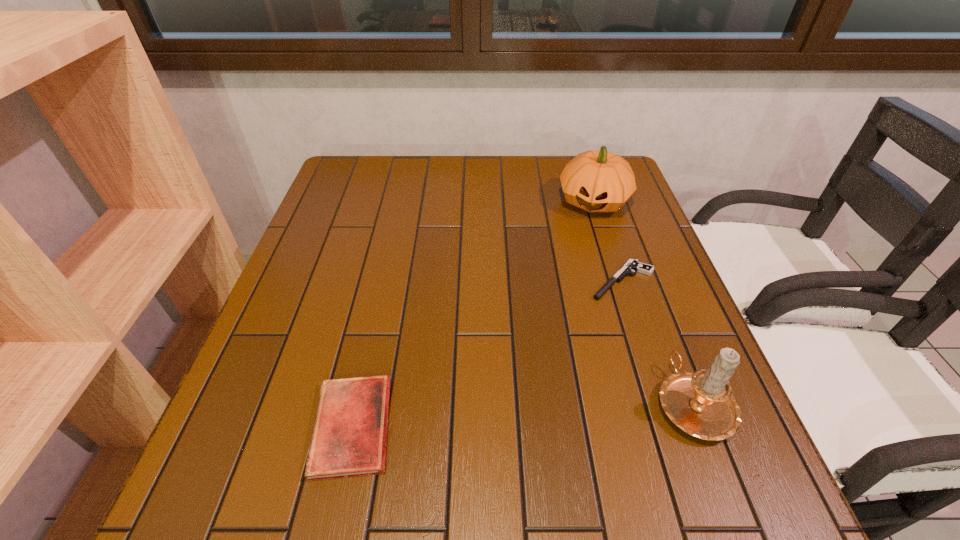
At what (x,y) coordinates should I click in order to perform the action: click on vacant space located on the front-facing side of the shortest object. Please return your answer as a coordinate pair (x, y). Looking at the image, I should click on [557, 347].

You are a GUI agent. You are given a task and a screenshot of the screen. Output one action in this format:
    pyautogui.click(x=<x>, y=<y>)
    Task: Click on the free space located on the side of the gourd with the carved face
    This screenshot has width=960, height=540.
    Given the screenshot: What is the action you would take?
    pyautogui.click(x=563, y=310)

In order to click on vacant space located 0.150m on the side of the gourd with the carved face in this screenshot , I will do coord(578,256).

Find the location of a particular element. The image size is (960, 540). vacant space located on the side of the gourd with the carved face is located at coordinates (559, 324).

Where is `object at the far edge`? The width and height of the screenshot is (960, 540). object at the far edge is located at coordinates (595, 181).

The height and width of the screenshot is (540, 960). What are the coordinates of `diary that is positioned at the near edge` in the screenshot? It's located at (349, 438).

You are a GUI agent. You are given a task and a screenshot of the screen. Output one action in this format:
    pyautogui.click(x=<x>, y=<y>)
    Task: Click on the candle located in the near edge section of the desktop
    The width and height of the screenshot is (960, 540).
    Given the screenshot: What is the action you would take?
    pyautogui.click(x=701, y=403)

Find the location of a particular element. Image resolution: width=960 pixels, height=540 pixels. object present at the left edge is located at coordinates (349, 438).

Where is `candle located at the right edge`? The image size is (960, 540). candle located at the right edge is located at coordinates (701, 403).

Where is `pistol positioned at the right edge`? The image size is (960, 540). pistol positioned at the right edge is located at coordinates (633, 265).